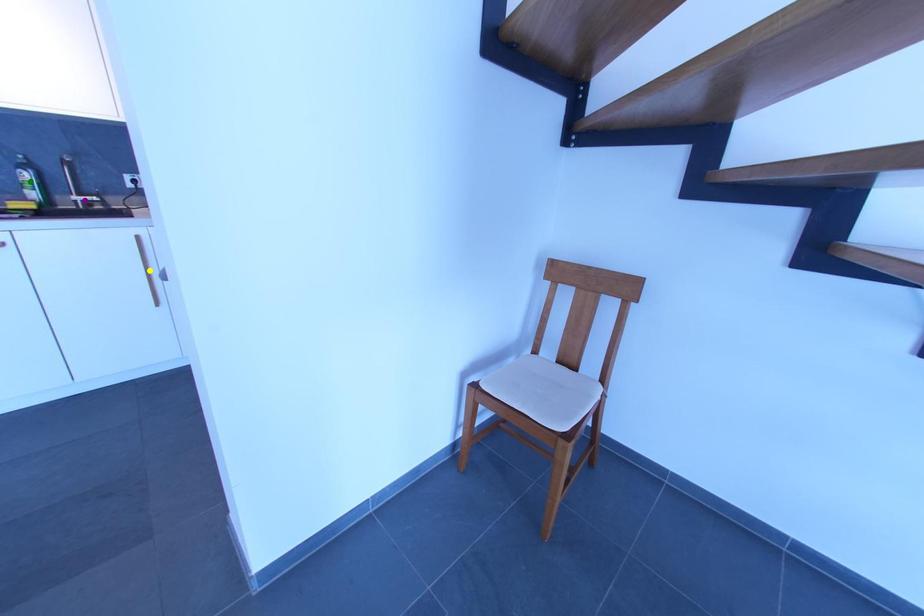
Order these from nearest to farthest:
green point, purple point, yellow point

green point < purple point < yellow point